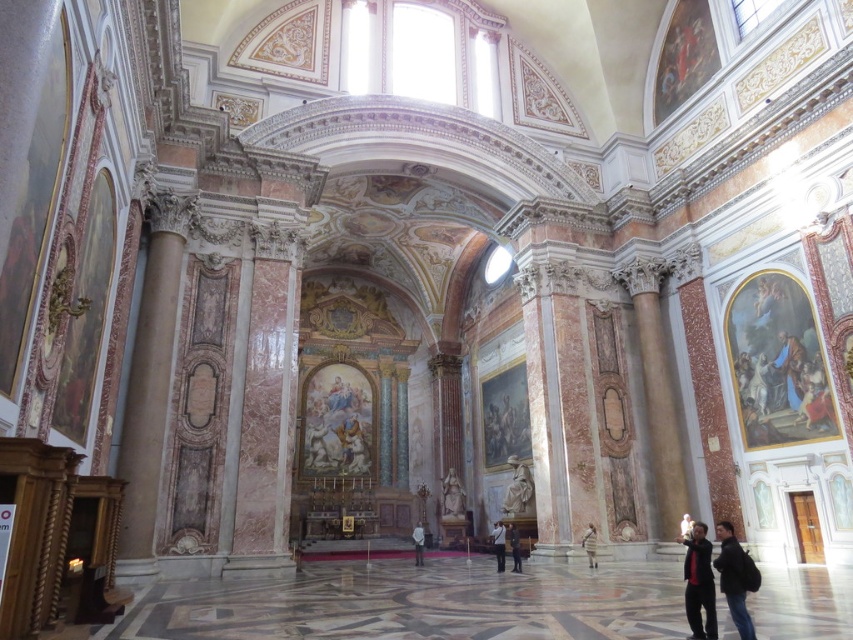
Which is more to the right, light gray fabric jacket at center or light brown leather jacket at center?

Positioned to the right is light brown leather jacket at center.

Describe the element at coordinates (418, 544) in the screenshot. Image resolution: width=853 pixels, height=640 pixels. I see `light gray fabric jacket at center` at that location.

At what (x,y) coordinates should I click in order to perform the action: click on light gray fabric jacket at center. Please return your answer as a coordinate pair (x, y). Looking at the image, I should click on click(418, 544).

Between light beige fabric coat at lower right and dark blue jeans at lower center, which one has more height?

dark blue jeans at lower center

Which is behind, point (592, 528) or point (511, 531)?

The point (511, 531) is behind.

Does point (590, 547) lie behind point (509, 538)?

No, (590, 547) is closer to viewer.

At what (x,y) coordinates should I click in order to perform the action: click on light beige fabric coat at lower right. Please return your answer as a coordinate pair (x, y). This screenshot has height=640, width=853. Looking at the image, I should click on (590, 545).

Who is higher up, dark red fabric jacket at lower right or dark blue jeans at lower center?

dark red fabric jacket at lower right is above.

Is point (708, 563) positioned after point (519, 556)?

No.

Is point (705, 541) positioned behind point (518, 541)?

That is False.

Where is `dark red fabric jacket at lower right`? The image size is (853, 640). dark red fabric jacket at lower right is located at coordinates (698, 582).